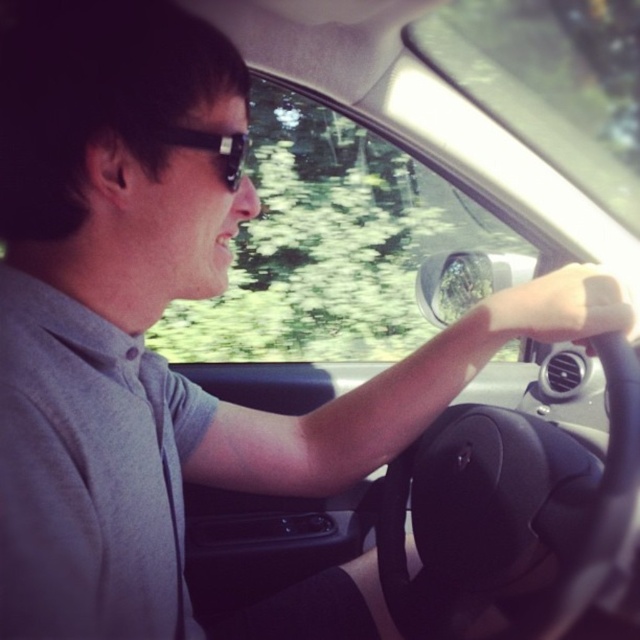
Based on the photo, who is taller, black rubber steering wheel at center or slightly translucent skin at steering wheel center?

black rubber steering wheel at center

Does black rubber steering wheel at center appear on the left side of slightly translucent skin at steering wheel center?

Yes, black rubber steering wheel at center is to the left of slightly translucent skin at steering wheel center.

This screenshot has width=640, height=640. Find the location of `black rubber steering wheel at center`. black rubber steering wheel at center is located at coordinates (508, 508).

What do you see at coordinates (557, 307) in the screenshot? This screenshot has width=640, height=640. I see `slightly translucent skin at steering wheel center` at bounding box center [557, 307].

Where is `slightly translucent skin at steering wheel center`? slightly translucent skin at steering wheel center is located at coordinates (557, 307).

Which is in front, point (557, 500) or point (224, 141)?

Positioned in front is point (224, 141).

Can you confirm if black rubber steering wheel at center is positioned to the left of black plastic sunglasses at upper center?

In fact, black rubber steering wheel at center is to the right of black plastic sunglasses at upper center.

Describe the element at coordinates (508, 508) in the screenshot. This screenshot has height=640, width=640. I see `black rubber steering wheel at center` at that location.

Where is `black rubber steering wheel at center`? The image size is (640, 640). black rubber steering wheel at center is located at coordinates (508, 508).